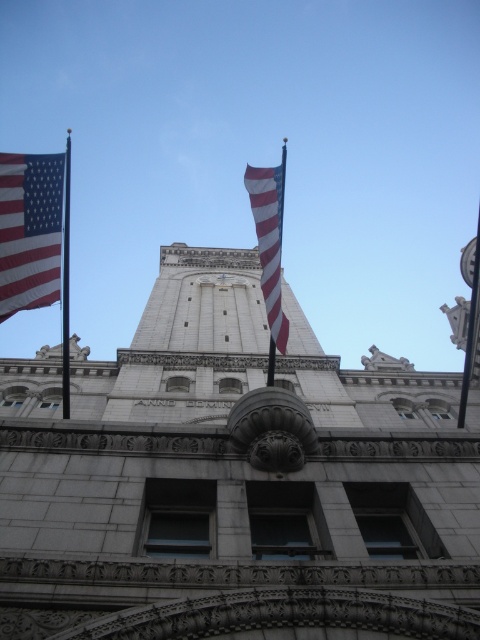
You are standing in front of a historic building and see the matte fabric flag at left and the matte fabric flag at center. Which flag is shorter?

The matte fabric flag at left is shorter than the matte fabric flag at center.

You are a photographer planning to take a picture of the white stone tower at center and the matte fabric flag at left. From the photographer perspective, which object is located to the right of the other?

The white stone tower at center is positioned on the right side of the matte fabric flag at left, so the tower is to the right of the flag.